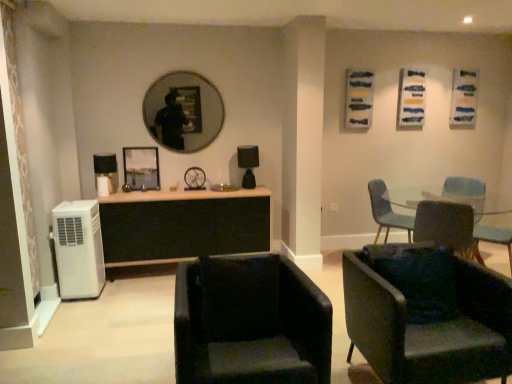
Measure the distance between point (250, 180) and camera.

Point (250, 180) is 4.28 meters away from camera.

I want to click on velvet green armchair at lower right, which is the 2th chair in front-to-back order, so click(x=426, y=315).

Describe the element at coordinates (426, 315) in the screenshot. This screenshot has width=512, height=384. I see `velvet green armchair at lower right, acting as the 3th chair starting from the back` at that location.

Describe the element at coordinates (448, 227) in the screenshot. I see `matte black chair at lower right, which is counted as the second chair, starting from the back` at that location.

Image resolution: width=512 pixels, height=384 pixels. What do you see at coordinates (386, 211) in the screenshot? I see `teal fabric chair at center right, which appears as the fourth chair when viewed from the front` at bounding box center [386, 211].

Identify the location of black wood cabinet at center. (182, 226).

Who is more distant, white plastic air conditioner at lower left or teal fabric chair at center right, which appears as the fourth chair when viewed from the front?

teal fabric chair at center right, which appears as the fourth chair when viewed from the front, is further away from the camera.

From the image's perspective, between white plastic air conditioner at lower left and teal fabric chair at center right, which appears as the fourth chair when viewed from the front, who is located below?

white plastic air conditioner at lower left.

Do you think white plastic air conditioner at lower left is within teal fabric chair at center right, which appears as the fourth chair when viewed from the front, or outside of it?

white plastic air conditioner at lower left is not enclosed by teal fabric chair at center right, which appears as the fourth chair when viewed from the front.

I want to click on the 3rd chair in front when counting from the teal fabric chair at center right, which appears as the fourth chair when viewed from the front, so click(x=250, y=323).

Is black leather chair at lower center, placed as the fourth chair when sorted from back to front, in contact with teal fabric chair at center right, the first chair when ordered from back to front?

No.

Is black leather chair at lower center, placed as the fourth chair when sorted from back to front, facing away from teal fabric chair at center right, the first chair when ordered from back to front?

That's not correct — black leather chair at lower center, placed as the fourth chair when sorted from back to front, is not looking away from teal fabric chair at center right, the first chair when ordered from back to front.

Can you confirm if black leather chair at lower center, which ranks as the first chair in front-to-back order, is smaller than teal fabric chair at center right, the first chair when ordered from back to front?

No.

From the image's perspective, between metallic silver picture frame at center and white plastic air conditioner at lower left, who is located below?

white plastic air conditioner at lower left.

Does point (139, 177) appear closer or farther from the camera than point (104, 277)?

Point (139, 177) is positioned farther from the camera compared to point (104, 277).

Is the position of metallic silver picture frame at center less distant than that of white plastic air conditioner at lower left?

No, metallic silver picture frame at center is further to the viewer.

Is metallic silver picture frame at center at the right side of white plastic air conditioner at lower left?

Indeed, metallic silver picture frame at center is positioned on the right side of white plastic air conditioner at lower left.

In the scene shown: Which of these two, velvet green armchair at lower right, which is the 2th chair in front-to-back order, or black leather chair at lower center, placed as the fourth chair when sorted from back to front, is wider?

black leather chair at lower center, placed as the fourth chair when sorted from back to front.

Is velvet green armchair at lower right, acting as the 3th chair starting from the back, looking in the opposite direction of black leather chair at lower center, which ranks as the first chair in front-to-back order?

No, velvet green armchair at lower right, acting as the 3th chair starting from the back,'s orientation is not away from black leather chair at lower center, which ranks as the first chair in front-to-back order.

Where is `the 1st chair above the velvet green armchair at lower right, which is the 2th chair in front-to-back order (from a real-world perspective)`? Image resolution: width=512 pixels, height=384 pixels. the 1st chair above the velvet green armchair at lower right, which is the 2th chair in front-to-back order (from a real-world perspective) is located at coordinates (250, 323).

Which is in front, velvet green armchair at lower right, acting as the 3th chair starting from the back, or black leather chair at lower center, which ranks as the first chair in front-to-back order?

Positioned in front is black leather chair at lower center, which ranks as the first chair in front-to-back order.

Which object is thinner, matte black mirror at upper center or black wood cabinet at center?

matte black mirror at upper center is thinner.

Consider the image. Can you confirm if matte black mirror at upper center is bigger than black wood cabinet at center?

Incorrect, matte black mirror at upper center is not larger than black wood cabinet at center.

Is point (199, 97) behind point (203, 208)?

Yes, it is behind point (203, 208).

In the scene shown: Considering the sizes of objects velvet green armchair at lower right, which is the 2th chair in front-to-back order, and metallic silver picture frame at center in the image provided, who is taller, velvet green armchair at lower right, which is the 2th chair in front-to-back order, or metallic silver picture frame at center?

velvet green armchair at lower right, which is the 2th chair in front-to-back order.

From the image's perspective, which one is positioned lower, velvet green armchair at lower right, which is the 2th chair in front-to-back order, or metallic silver picture frame at center?

velvet green armchair at lower right, which is the 2th chair in front-to-back order.

From a real-world perspective, is velvet green armchair at lower right, which is the 2th chair in front-to-back order, physically below metallic silver picture frame at center?

Yes.

Is velvet green armchair at lower right, which is the 2th chair in front-to-back order, at the left side of metallic silver picture frame at center?

In fact, velvet green armchair at lower right, which is the 2th chair in front-to-back order, is to the right of metallic silver picture frame at center.

Considering the sizes of objects black wood cabinet at center and black leather chair at lower center, placed as the fourth chair when sorted from back to front, in the image provided, who is shorter, black wood cabinet at center or black leather chair at lower center, placed as the fourth chair when sorted from back to front,?

black leather chair at lower center, placed as the fourth chair when sorted from back to front.

Is point (223, 194) closer or farther from the camera than point (228, 332)?

Point (223, 194) is positioned farther from the camera compared to point (228, 332).

Is black wood cabinet at center next to black leather chair at lower center, which ranks as the first chair in front-to-back order?

No.

Is black wood cabinet at center further to camera compared to black leather chair at lower center, which ranks as the first chair in front-to-back order?

Yes, it is.

From a real-world perspective, count 1st chairs upward from the white plastic air conditioner at lower left and point to it. Please provide its 2D coordinates.

[(386, 211)]

Identify the location of chair that is the 3rd object located in front of the teal fabric chair at center right, which appears as the fourth chair when viewed from the front. (250, 323).

Which object lies further to the anchor point black wood cabinet at center, metallic silver picture frame at center or white plastic air conditioner at lower left?

metallic silver picture frame at center.

Looking at this image, estimate the real-world distances between objects in this image. Which object is further from matte black chair at lower right, the third chair when ordered from front to back, teal fabric chair at center right, the first chair when ordered from back to front, or velvet green armchair at lower right, which is the 2th chair in front-to-back order?

Based on the image, velvet green armchair at lower right, which is the 2th chair in front-to-back order, appears to be further to matte black chair at lower right, the third chair when ordered from front to back.

Based on their spatial positions, is matte black lamp at center or black leather chair at lower center, placed as the fourth chair when sorted from back to front, closer to matte black mirror at upper center?

matte black lamp at center is positioned closer to the anchor matte black mirror at upper center.

Considering their positions, is teal fabric chair at center right, the first chair when ordered from back to front, positioned closer to black leather chair at lower center, which ranks as the first chair in front-to-back order, than matte black mirror at upper center?

Based on the image, matte black mirror at upper center appears to be nearer to black leather chair at lower center, which ranks as the first chair in front-to-back order.

Estimate the real-world distances between objects in this image. Which object is closer to white plastic air conditioner at lower left, teal fabric chair at center right, which appears as the fourth chair when viewed from the front, or metallic silver picture frame at center?

The object closer to white plastic air conditioner at lower left is metallic silver picture frame at center.

From the image, which object appears to be farther from black wood cabinet at center, metallic silver picture frame at center or teal fabric chair at center right, the first chair when ordered from back to front?

Among the two, teal fabric chair at center right, the first chair when ordered from back to front, is located further to black wood cabinet at center.

Estimate the real-world distances between objects in this image. Which object is further from velvet green armchair at lower right, acting as the 3th chair starting from the back, matte black mirror at upper center or black leather chair at lower center, which ranks as the first chair in front-to-back order?

The object further to velvet green armchair at lower right, acting as the 3th chair starting from the back, is matte black mirror at upper center.

Based on their spatial positions, is matte black lamp at center or matte black mirror at upper center further from teal fabric chair at center right, which appears as the fourth chair when viewed from the front?

matte black mirror at upper center lies further to teal fabric chair at center right, which appears as the fourth chair when viewed from the front, than the other object.

This screenshot has width=512, height=384. Find the location of `cabinetry between black leather chair at lower center, placed as the fourth chair when sorted from back to front, and matte black lamp at center from front to back`. cabinetry between black leather chair at lower center, placed as the fourth chair when sorted from back to front, and matte black lamp at center from front to back is located at coordinates (182, 226).

Locate an element on the screen. mirror between velvet green armchair at lower right, which is the 2th chair in front-to-back order, and matte black lamp at center from front to back is located at coordinates (183, 111).

In order to click on air conditioning between black leather chair at lower center, which ranks as the first chair in front-to-back order, and matte black lamp at center from front to back in this screenshot , I will do `click(78, 249)`.

You are a GUI agent. You are given a task and a screenshot of the screen. Output one action in this format:
    pyautogui.click(x=<x>, y=<y>)
    Task: Click on the mirror between white plastic air conditioner at lower left and matte black lamp at center
    The width and height of the screenshot is (512, 384).
    Given the screenshot: What is the action you would take?
    pyautogui.click(x=183, y=111)